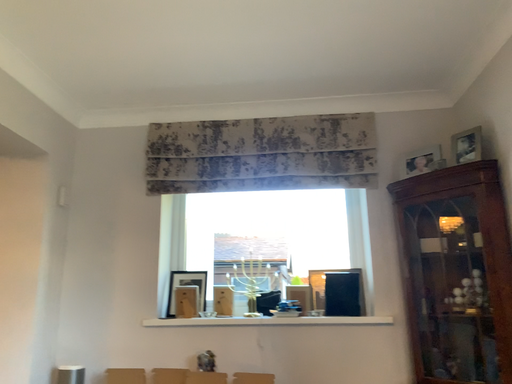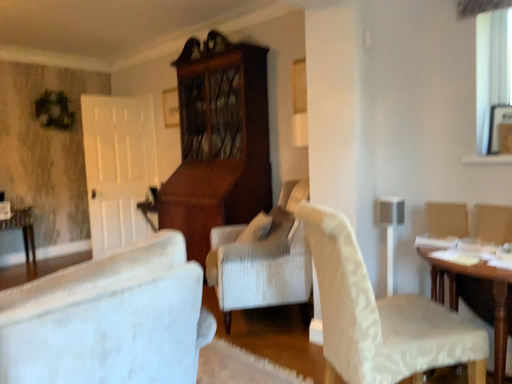
Question: How did the camera likely rotate when shooting the video?

Choices:
 (A) rotated upward
 (B) rotated downward

Answer: (B)